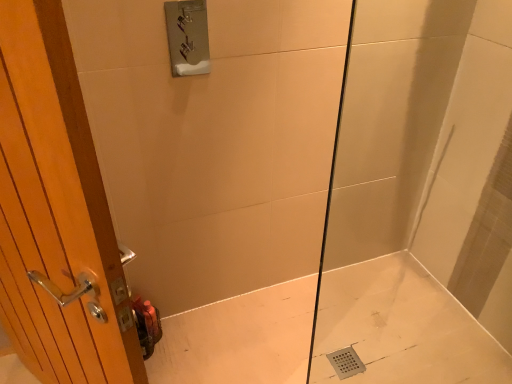
Locate an element on the screen. This screenshot has height=384, width=512. wooden door at left is located at coordinates (56, 214).

From the picture: Is transparent glass shower door at center closer to camera compared to white glossy bath at lower right?

That is True.

Considering the positions of points (482, 283) and (352, 332), is point (482, 283) farther from camera compared to point (352, 332)?

No, (482, 283) is in front of (352, 332).

Is white glossy bath at lower right next to transparent glass shower door at center and touching it?

There is a gap between white glossy bath at lower right and transparent glass shower door at center.

Considering the sizes of white glossy bath at lower right and transparent glass shower door at center in the image, is white glossy bath at lower right taller or shorter than transparent glass shower door at center?

In the image, white glossy bath at lower right appears to be shorter than transparent glass shower door at center.

In the scene shown: Can you confirm if white glossy bath at lower right is thinner than transparent glass shower door at center?

In fact, white glossy bath at lower right might be wider than transparent glass shower door at center.

Is point (282, 356) positioned in front of point (461, 293)?

Yes, it is in front of point (461, 293).

How many degrees apart are the facing directions of wooden door at left and white glossy bath at lower right?

wooden door at left and white glossy bath at lower right are facing 124 degrees away from each other.

Does wooden door at left come behind white glossy bath at lower right?

That is False.

Consider the image. Considering the sizes of objects wooden door at left and white glossy bath at lower right in the image provided, who is taller, wooden door at left or white glossy bath at lower right?

Standing taller between the two is wooden door at left.

Considering the relative positions of wooden door at left and white glossy bath at lower right in the image provided, is wooden door at left to the left of white glossy bath at lower right from the viewer's perspective?

Correct, you'll find wooden door at left to the left of white glossy bath at lower right.

Is white glossy bath at lower right far away from wooden door at left?

Yes, white glossy bath at lower right is far from wooden door at left.

From the image's perspective, which one is positioned lower, white glossy bath at lower right or wooden door at left?

white glossy bath at lower right, from the image's perspective.

Measure the distance from transparent glass shower door at center to wooden door at left.

transparent glass shower door at center is 1.25 meters from wooden door at left.

Based on the photo, could you tell me if transparent glass shower door at center is turned towards wooden door at left?

No.

From the image's perspective, between transparent glass shower door at center and wooden door at left, who is located below?

transparent glass shower door at center appears lower in the image.

Is wooden door at left outside of transparent glass shower door at center?

Absolutely, wooden door at left is external to transparent glass shower door at center.

Is point (34, 262) positioned behind point (443, 291)?

No, (34, 262) is closer to viewer.

Is wooden door at left bigger than transparent glass shower door at center?

Yes, wooden door at left is bigger than transparent glass shower door at center.

Which object is closer to the camera taking this photo, wooden door at left or transparent glass shower door at center?

Positioned in front is wooden door at left.

Locate an element on the screen. The image size is (512, 384). shower door on the right of white glossy bath at lower right is located at coordinates coord(421,199).

Locate an element on the screen. This screenshot has height=384, width=512. shower door lying above the white glossy bath at lower right (from the image's perspective) is located at coordinates (421, 199).

Estimate the real-world distances between objects in this image. Which object is closer to white glossy bath at lower right, transparent glass shower door at center or wooden door at left?

The object closer to white glossy bath at lower right is transparent glass shower door at center.

Looking at the image, which one is located further to wooden door at left, transparent glass shower door at center or white glossy bath at lower right?

transparent glass shower door at center.

Looking at the image, which one is located closer to transparent glass shower door at center, white glossy bath at lower right or wooden door at left?

The object closer to transparent glass shower door at center is white glossy bath at lower right.

Estimate the real-world distances between objects in this image. Which object is closer to white glossy bath at lower right, wooden door at left or transparent glass shower door at center?

Based on the image, transparent glass shower door at center appears to be nearer to white glossy bath at lower right.

Based on the photo, which object lies nearer to the anchor point wooden door at left, white glossy bath at lower right or transparent glass shower door at center?

Among the two, white glossy bath at lower right is located nearer to wooden door at left.

When comparing their distances from transparent glass shower door at center, does wooden door at left or white glossy bath at lower right seem further?

Among the two, wooden door at left is located further to transparent glass shower door at center.

Find the location of a particular element. The width and height of the screenshot is (512, 384). bath situated between wooden door at left and transparent glass shower door at center from left to right is located at coordinates (x=405, y=329).